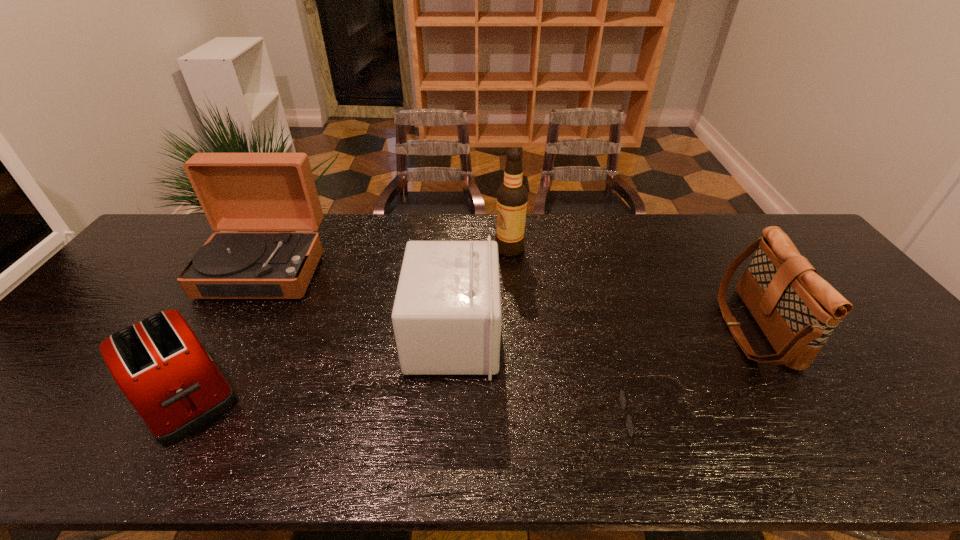
Where is `vacant position in the image that satisfies the following two spatial constraints: 1. on the label of the third object from right to left; 2. on the front side of the toaster`? The height and width of the screenshot is (540, 960). vacant position in the image that satisfies the following two spatial constraints: 1. on the label of the third object from right to left; 2. on the front side of the toaster is located at coordinates (521, 392).